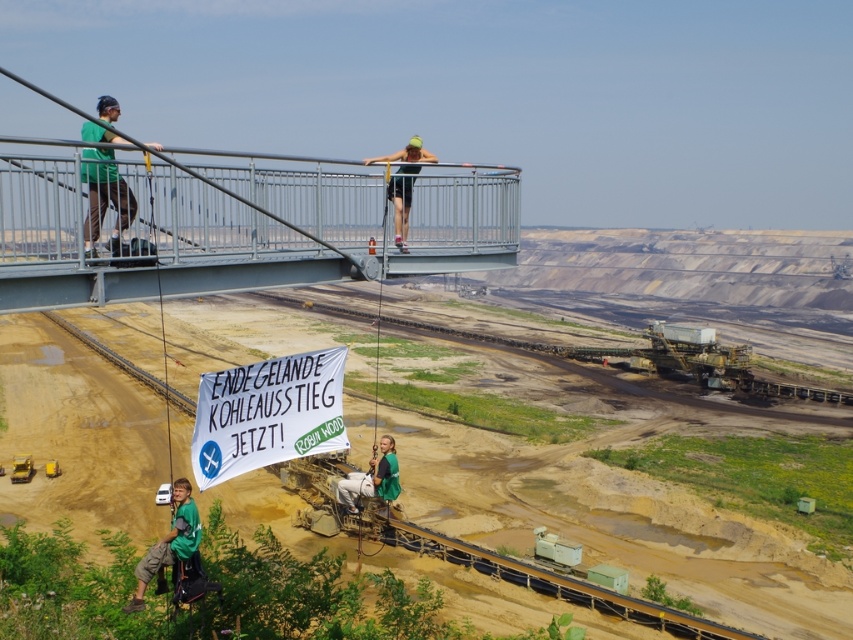
You are a photographer standing at the edge of the mining site. You want to take a photo of the green matte shirt at lower left and the green fabric shorts at center in the same frame. Given that your camera has a 50mm lens, which has a field of view of approximately 46 degrees, can you fit both objects into the frame without moving your position?

The green matte shirt at lower left and green fabric shorts at center are 7.77 meters apart. With a 50mm lens providing a 46 degree field of view, the maximum distance between two objects that can be captured in the same frame would depend on the distance from the camera to the objects. Without knowing the exact distance, it is impossible to determine if they can be framed together.

What object is located at the point with coordinates (105, 204)?

The point at coordinates (105, 204) corresponds to the green matte shirt at left.